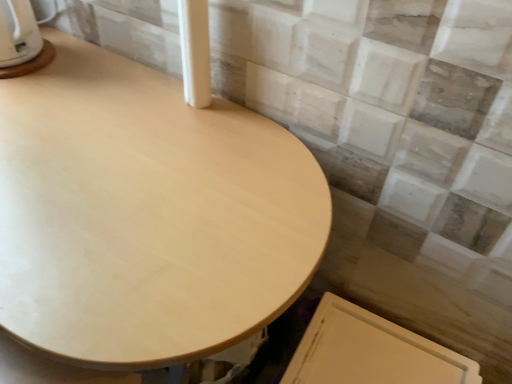
Question: Considering the relative positions of light wood table at center and white glossy kettle at upper left in the image provided, is light wood table at center to the right of white glossy kettle at upper left from the viewer's perspective?

Choices:
 (A) yes
 (B) no

Answer: (A)

Question: Can you confirm if light wood table at center is shorter than white glossy kettle at upper left?

Choices:
 (A) no
 (B) yes

Answer: (A)

Question: Is light wood table at center placed right next to white glossy kettle at upper left?

Choices:
 (A) yes
 (B) no

Answer: (B)

Question: Is light wood table at center thinner than white glossy kettle at upper left?

Choices:
 (A) yes
 (B) no

Answer: (B)

Question: Is light wood table at center wider than white glossy kettle at upper left?

Choices:
 (A) yes
 (B) no

Answer: (A)

Question: Relative to white glossy kettle at upper left, is light wood table at center in front or behind?

Choices:
 (A) front
 (B) behind

Answer: (A)

Question: From a real-world perspective, is light wood table at center physically located above or below white glossy kettle at upper left?

Choices:
 (A) below
 (B) above

Answer: (A)

Question: From the image's perspective, relative to white glossy kettle at upper left, is light wood table at center above or below?

Choices:
 (A) above
 (B) below

Answer: (B)

Question: Considering the positions of light wood table at center and white glossy kettle at upper left in the image, is light wood table at center bigger or smaller than white glossy kettle at upper left?

Choices:
 (A) big
 (B) small

Answer: (A)

Question: Is white glossy kettle at upper left wider or thinner than light wood table at center?

Choices:
 (A) thin
 (B) wide

Answer: (A)

Question: Looking at the image, does white glossy kettle at upper left seem bigger or smaller compared to light wood table at center?

Choices:
 (A) small
 (B) big

Answer: (A)

Question: Is point (3, 74) closer or farther from the camera than point (247, 243)?

Choices:
 (A) closer
 (B) farther

Answer: (B)

Question: From the image's perspective, relative to light wood table at center, is white glossy kettle at upper left above or below?

Choices:
 (A) above
 (B) below

Answer: (A)

Question: Is white glossy kettle at upper left bigger or smaller than white smooth pillar at upper center?

Choices:
 (A) small
 (B) big

Answer: (B)

Question: Do you think white glossy kettle at upper left is within white smooth pillar at upper center, or outside of it?

Choices:
 (A) inside
 (B) outside

Answer: (B)